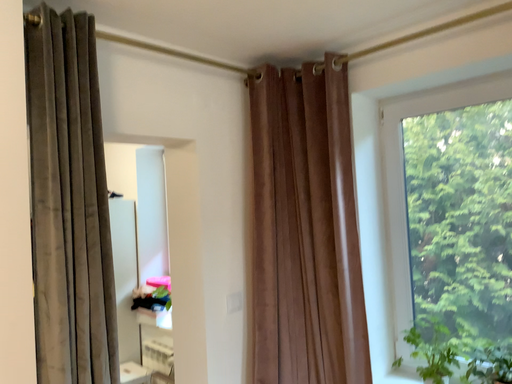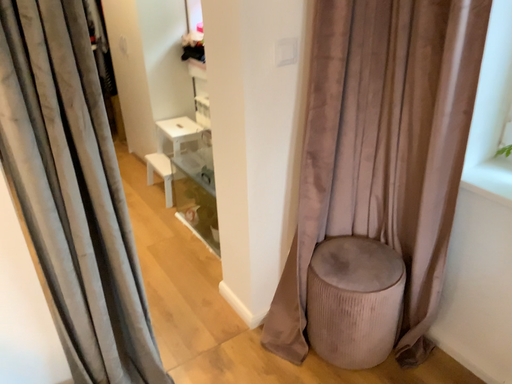
Question: How did the camera likely rotate when shooting the video?

Choices:
 (A) rotated left
 (B) rotated right

Answer: (A)